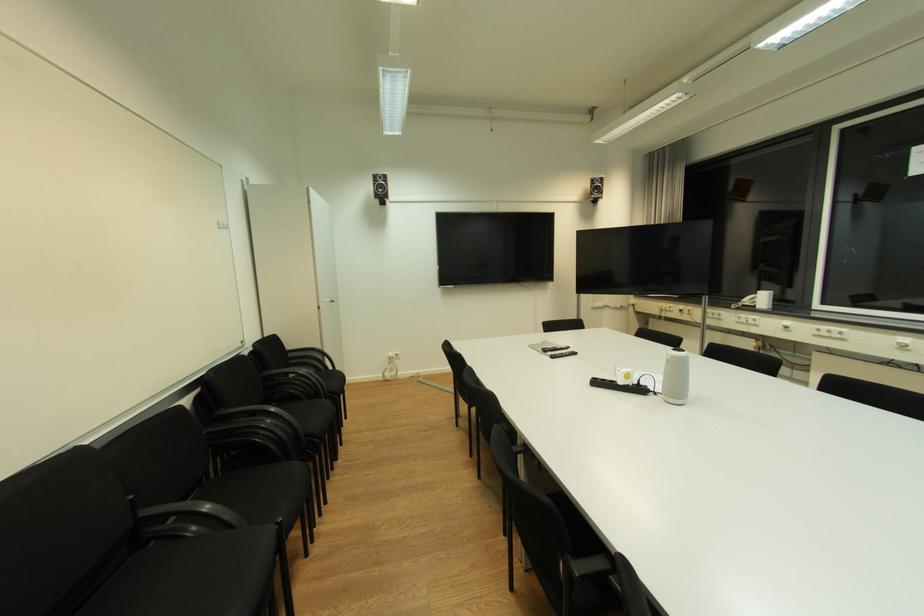
You are a GUI agent. You are given a task and a screenshot of the screen. Output one action in this format:
    pyautogui.click(x=<x>, y=<y>)
    Task: Click on the silver door handle
    The image size is (924, 616).
    Given the screenshot: What is the action you would take?
    pyautogui.click(x=332, y=302)